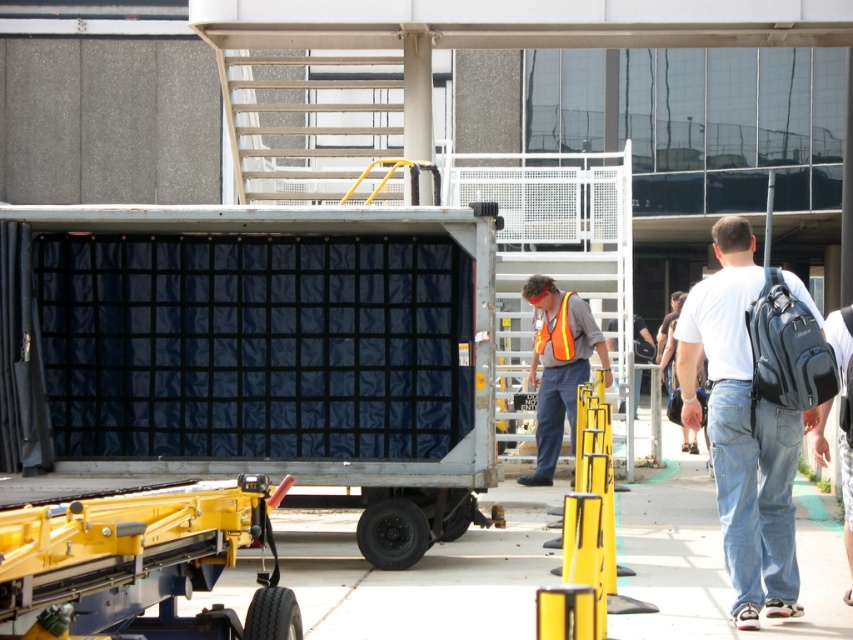
Between denim jeans at right and reflective orange safety vest at center, which one appears on the left side from the viewer's perspective?

reflective orange safety vest at center is more to the left.

Can you confirm if denim jeans at right is positioned to the right of reflective orange safety vest at center?

Yes, denim jeans at right is to the right of reflective orange safety vest at center.

Identify the location of denim jeans at right. Image resolution: width=853 pixels, height=640 pixels. (741, 433).